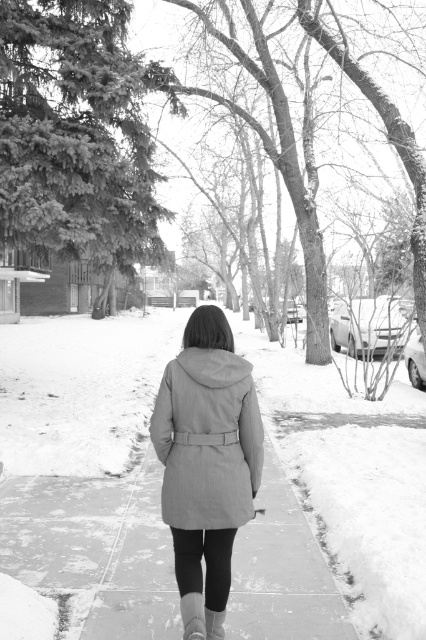
Question: Is gray wool coat at center to the right of matte gray boot at lower center from the viewer's perspective?

Choices:
 (A) yes
 (B) no

Answer: (B)

Question: Which point is closer to the camera?

Choices:
 (A) gray wool coat at center
 (B) gray suede boot at center

Answer: (B)

Question: Can you confirm if gray wool coat at center is smaller than gray suede boot at center?

Choices:
 (A) yes
 (B) no

Answer: (B)

Question: Which of the following is the closest to the observer?

Choices:
 (A) (199, 618)
 (B) (187, 364)

Answer: (A)

Question: Which of the following is the farthest from the observer?

Choices:
 (A) gray suede boot at center
 (B) gray wool coat at center
 (C) matte gray boot at lower center

Answer: (C)

Question: Is gray suede boot at center bigger than matte gray boot at lower center?

Choices:
 (A) no
 (B) yes

Answer: (B)